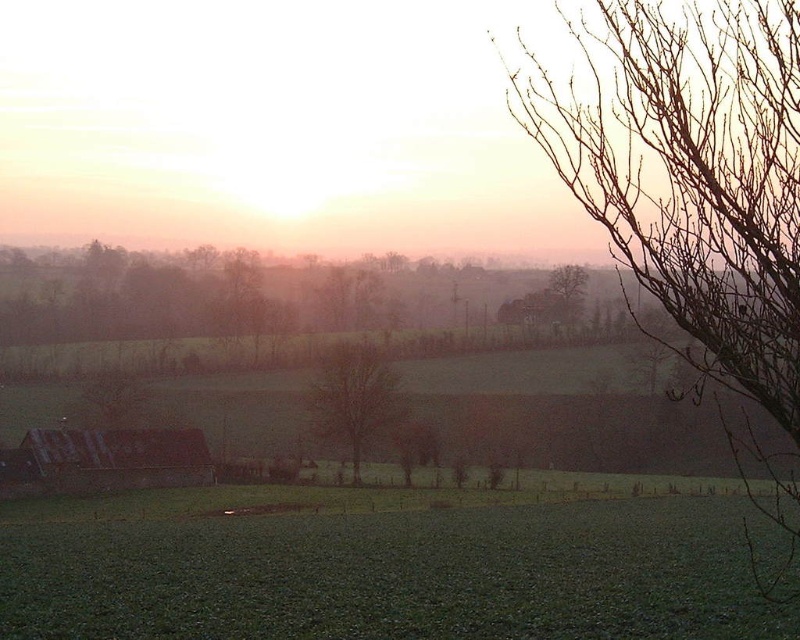
In the scene shown: Does green grassy field at lower center appear under bare branches at upper center?

Indeed, green grassy field at lower center is positioned under bare branches at upper center.

Between green grassy field at lower center and bare branches at upper center, which one is positioned higher?

bare branches at upper center

Between point (586, 573) and point (556, 298), which one is positioned behind?

Point (556, 298)

The image size is (800, 640). Identify the location of green grassy field at lower center. 386,564.

Does green grassy field at lower center come in front of bare tree at center?

That is True.

Is point (432, 525) more distant than point (325, 353)?

That is False.

Who is more distant from viewer, (684, 490) or (325, 355)?

The point (325, 355) is behind.

Where is `green grassy field at lower center`? This screenshot has width=800, height=640. green grassy field at lower center is located at coordinates (386, 564).

Does point (400, 545) come in front of point (629, 1)?

Yes, point (400, 545) is closer to viewer.

Between point (692, 547) and point (656, 36), which one is positioned in front?

Point (656, 36) is more forward.

Locate an element on the screen. The height and width of the screenshot is (640, 800). green grassy field at lower center is located at coordinates (386, 564).

The width and height of the screenshot is (800, 640). Find the location of `green grassy field at lower center`. green grassy field at lower center is located at coordinates (386, 564).